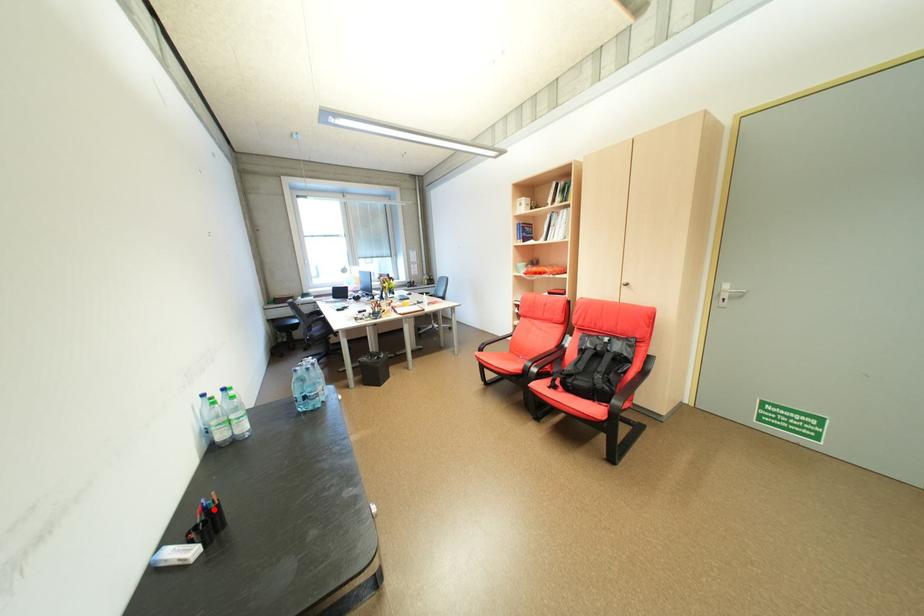
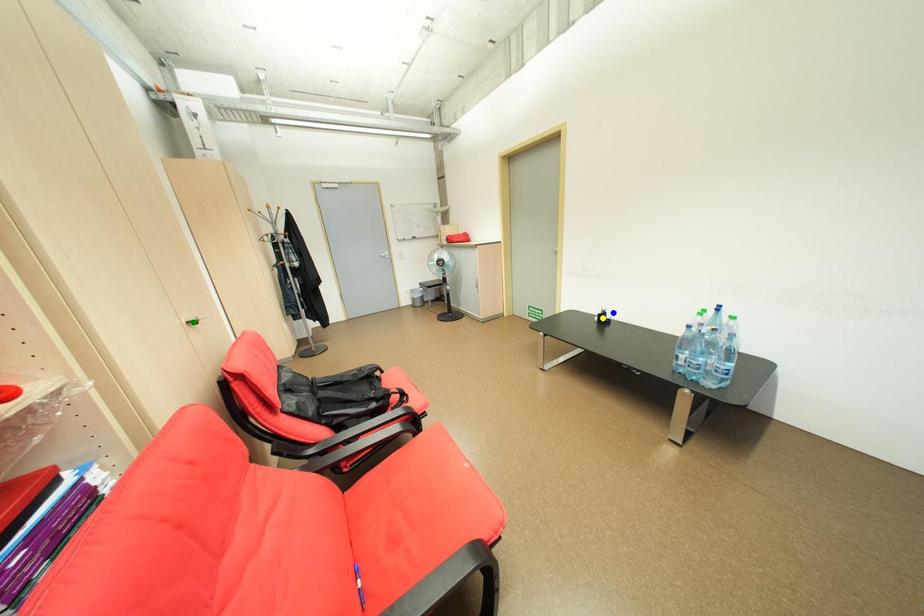
Question: I am providing you with two images of the same scene from different viewpoints. A red point is marked on the first image. You are given multiple points on the second image. In image 2, which mark is for the same physical point as the one in image 1?

Choices:
 (A) yellow point
 (B) blue point
 (C) green point

Answer: (B)